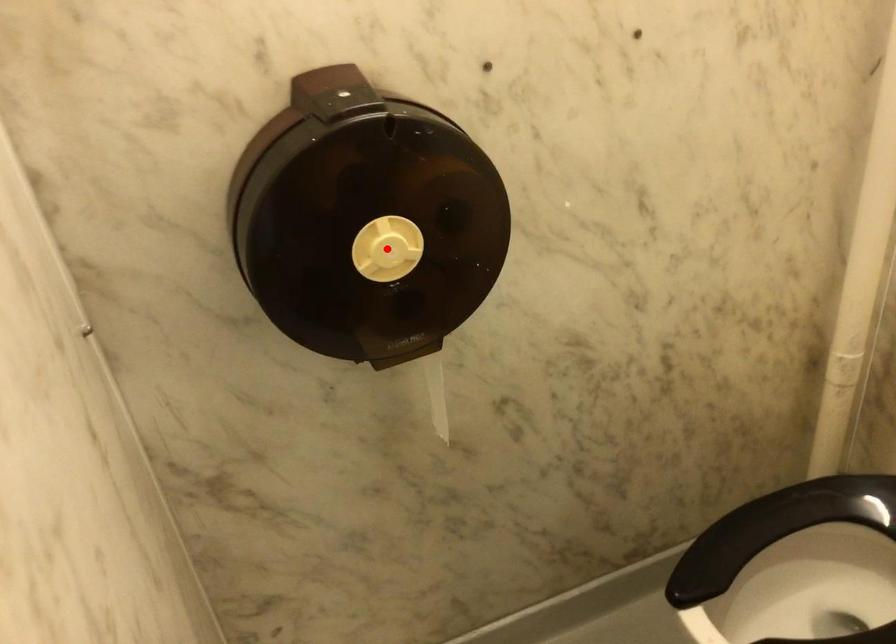
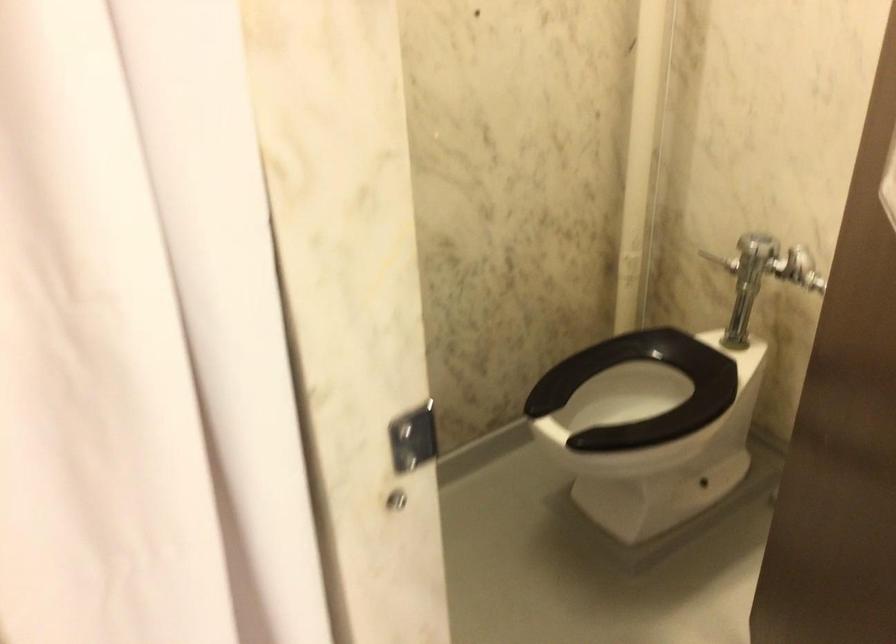
Question: I am providing you with two images of the same scene from different viewpoints. A red point is marked on the first image. Is the red point's position out of view in image 2?

Choices:
 (A) Yes
 (B) No

Answer: (A)